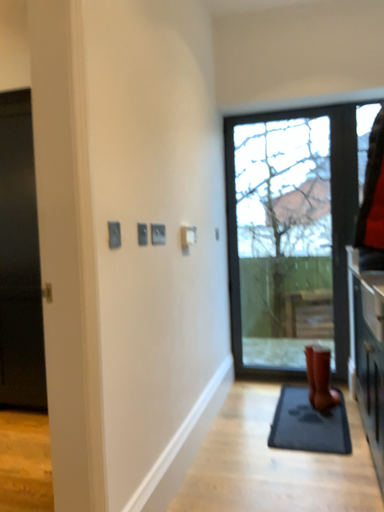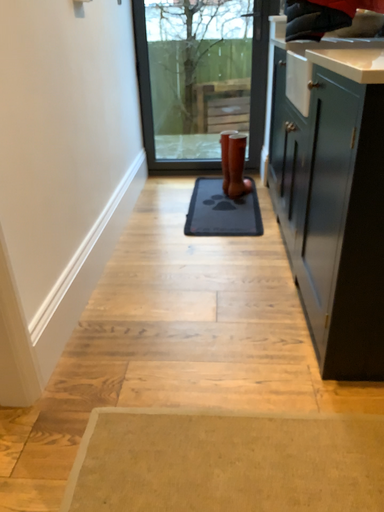
Question: Which way did the camera rotate in the video?

Choices:
 (A) rotated downward
 (B) rotated upward

Answer: (A)